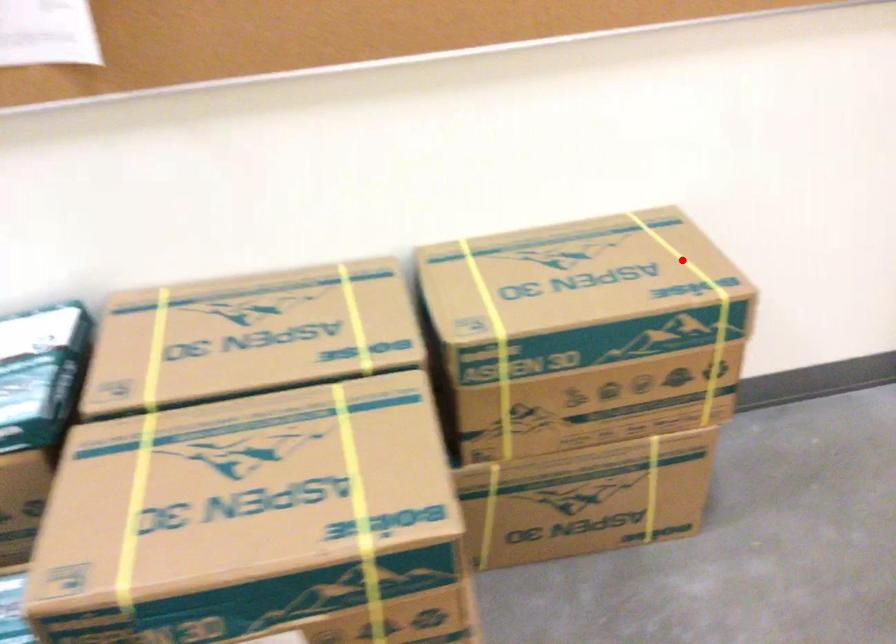
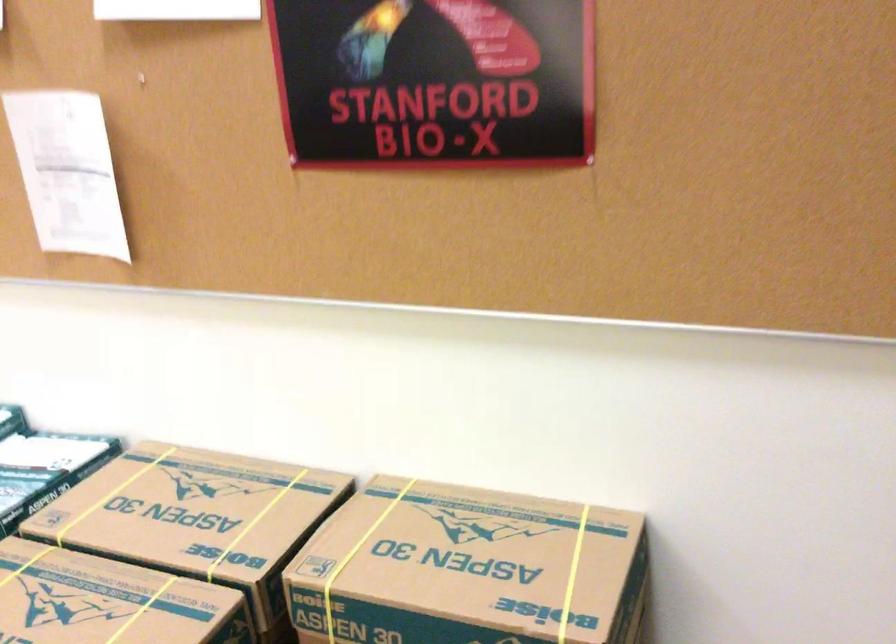
Question: I am providing you with two images of the same scene from different viewpoints. Given a red point in image1, look at the same physical point in image2. Is it:

Choices:
 (A) Closer to the viewpoint
 (B) Farther from the viewpoint

Answer: (A)